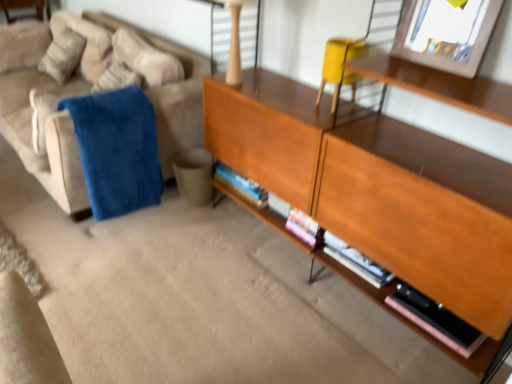
Question: From the image's perspective, would you say wooden picture frame at upper right is shown under wooden cabinet at center?

Choices:
 (A) no
 (B) yes

Answer: (A)

Question: Is wooden picture frame at upper right positioned behind wooden cabinet at center?

Choices:
 (A) yes
 (B) no

Answer: (A)

Question: From the image's perspective, is wooden picture frame at upper right located above wooden cabinet at center?

Choices:
 (A) no
 (B) yes

Answer: (B)

Question: From a real-world perspective, is wooden picture frame at upper right positioned under wooden cabinet at center based on gravity?

Choices:
 (A) yes
 (B) no

Answer: (B)

Question: Is wooden picture frame at upper right taller than wooden cabinet at center?

Choices:
 (A) yes
 (B) no

Answer: (B)

Question: From a real-world perspective, relative to pink matte book at lower right, is matte yellow swivel chair at upper right vertically above or below?

Choices:
 (A) above
 (B) below

Answer: (A)

Question: Considering the positions of matte yellow swivel chair at upper right and pink matte book at lower right in the image, is matte yellow swivel chair at upper right wider or thinner than pink matte book at lower right?

Choices:
 (A) thin
 (B) wide

Answer: (B)

Question: Is point (330, 64) closer or farther from the camera than point (441, 307)?

Choices:
 (A) farther
 (B) closer

Answer: (A)

Question: Considering their positions, is matte yellow swivel chair at upper right located in front of or behind pink matte book at lower right?

Choices:
 (A) front
 (B) behind

Answer: (B)

Question: Looking at their shapes, would you say wooden cabinet at center is wider or thinner than blue plush blanket at left?

Choices:
 (A) thin
 (B) wide

Answer: (A)

Question: Would you say wooden cabinet at center is inside or outside blue plush blanket at left?

Choices:
 (A) outside
 (B) inside

Answer: (A)

Question: From the image's perspective, is wooden cabinet at center positioned above or below blue plush blanket at left?

Choices:
 (A) above
 (B) below

Answer: (B)

Question: From a real-world perspective, is wooden cabinet at center physically located above or below blue plush blanket at left?

Choices:
 (A) above
 (B) below

Answer: (A)

Question: Would you say suede couch at left is to the left or to the right of matte yellow swivel chair at upper right in the picture?

Choices:
 (A) left
 (B) right

Answer: (A)

Question: Considering the positions of suede couch at left and matte yellow swivel chair at upper right in the image, is suede couch at left wider or thinner than matte yellow swivel chair at upper right?

Choices:
 (A) thin
 (B) wide

Answer: (B)